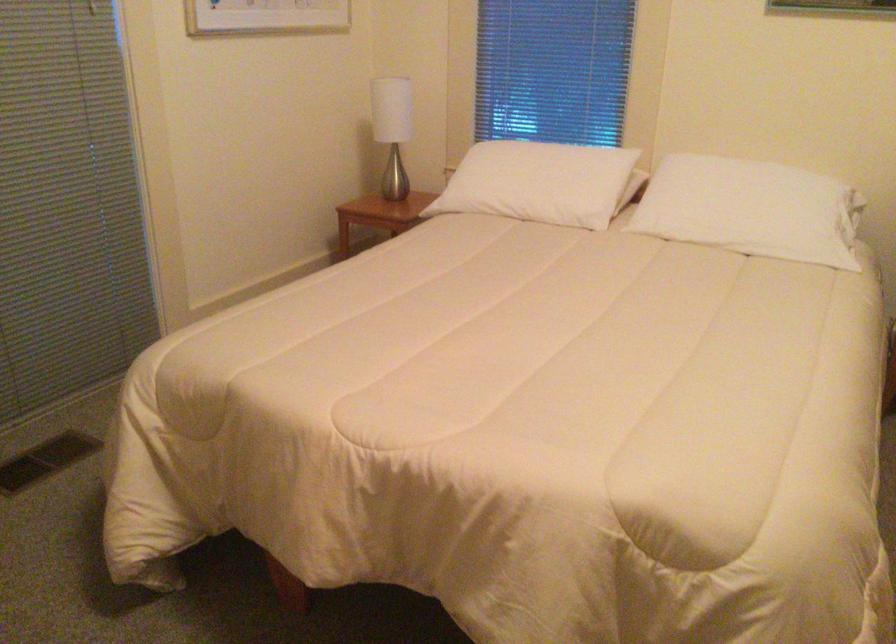
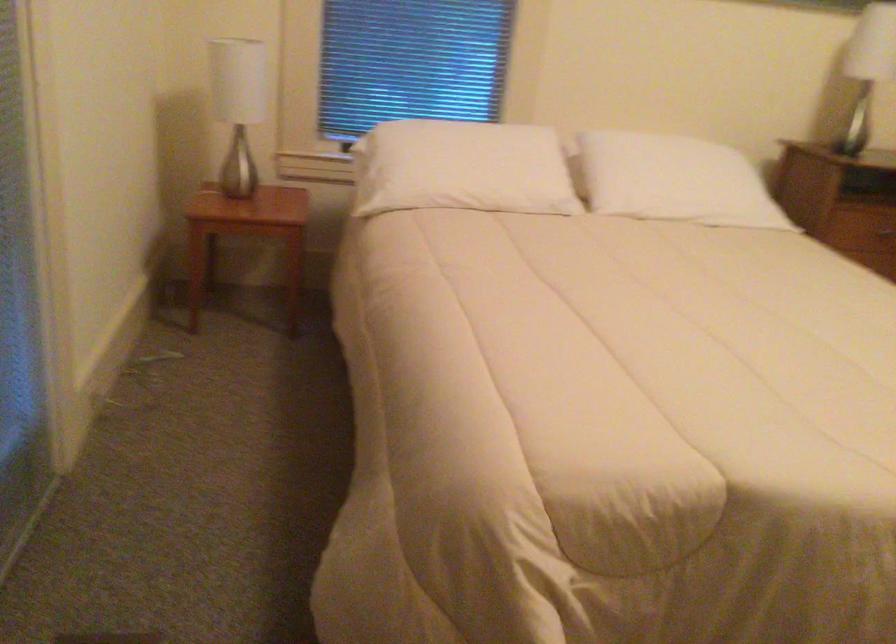
Find the pixel in the second image that matches [375,122] in the first image.

(238, 106)